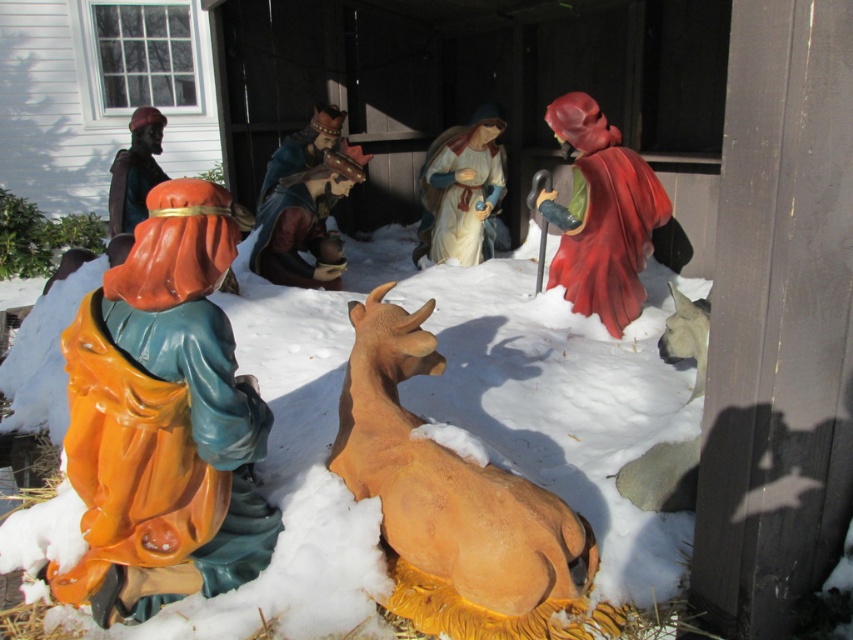
Is matte plastic baby at center thinner than matte black figure at upper left?

No, matte plastic baby at center is not thinner than matte black figure at upper left.

Can you confirm if matte plastic baby at center is shorter than matte black figure at upper left?

No, matte plastic baby at center is not shorter than matte black figure at upper left.

Between point (340, 140) and point (115, 205), which one is positioned in front?

Point (115, 205) is in front.

This screenshot has width=853, height=640. Identify the location of matte plastic baby at center. (305, 212).

Which is in front, point (363, 403) or point (136, 218)?

Positioned in front is point (363, 403).

Does point (456, 454) lie behind point (140, 170)?

That is False.

Which is behind, point (467, 516) or point (140, 220)?

Positioned behind is point (140, 220).

The width and height of the screenshot is (853, 640). What are the coordinates of `matte brown cow at center` in the screenshot? It's located at (453, 502).

Can you confirm if matte orange figure at left is thinner than matte plastic king at center?

In fact, matte orange figure at left might be wider than matte plastic king at center.

Is point (109, 406) positioned before point (291, 150)?

Yes.

At what (x,y) coordinates should I click in order to perform the action: click on matte orange figure at left. Please return your answer as a coordinate pair (x, y). Looking at the image, I should click on (164, 419).